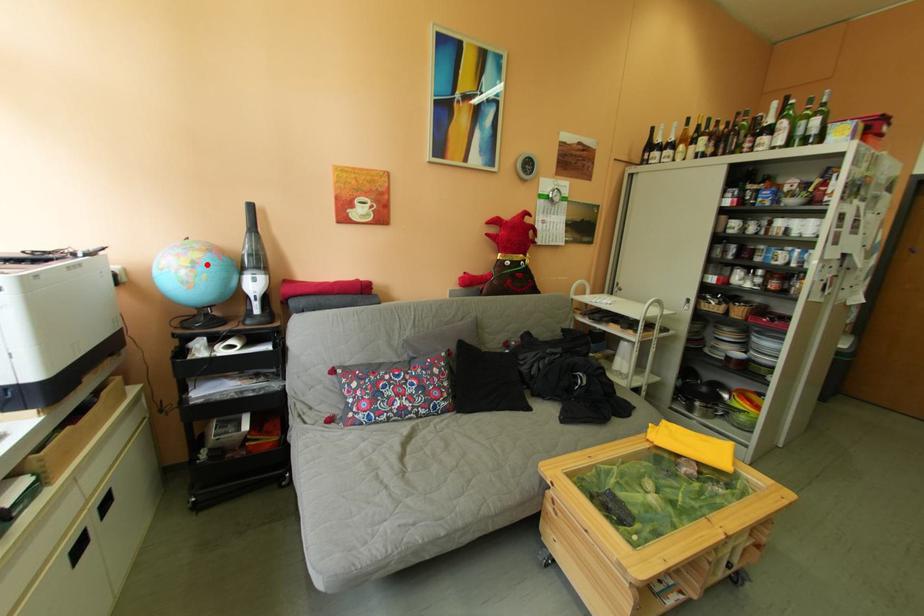
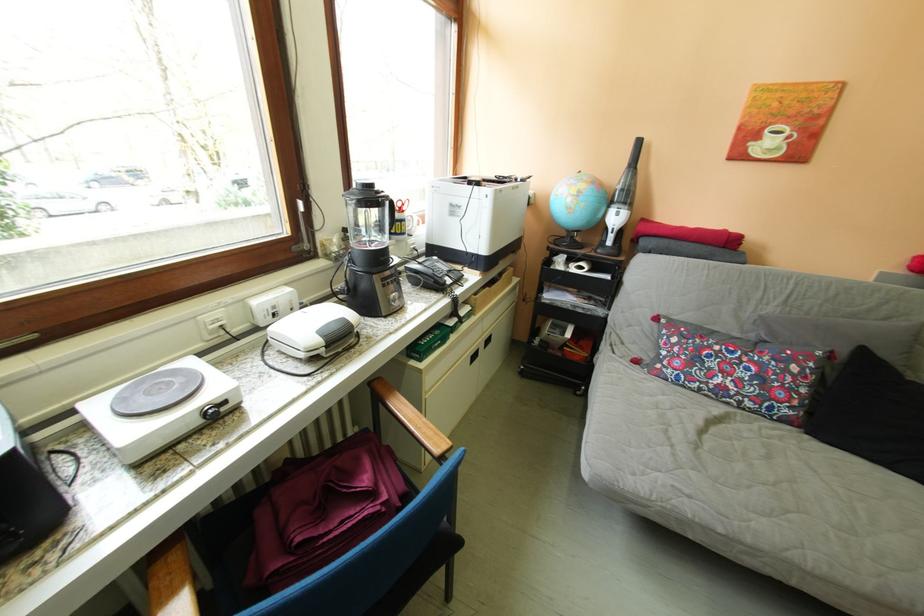
In the second image, find the point that corresponds to the highlighted location in the first image.

(591, 195)